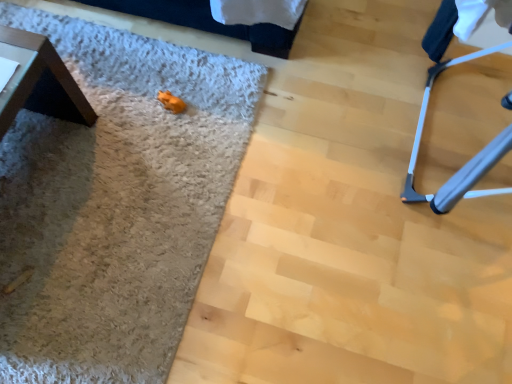
Locate an element on the screen. This screenshot has width=512, height=384. white shaggy rug at lower left is located at coordinates (115, 204).

What do you see at coordinates (115, 204) in the screenshot? I see `white shaggy rug at lower left` at bounding box center [115, 204].

The height and width of the screenshot is (384, 512). I want to click on white shaggy rug at lower left, so click(x=115, y=204).